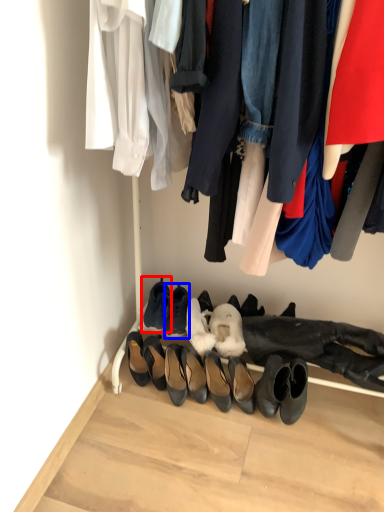
Question: Which object appears farthest to the camera in this image, footwear (highlighted by a red box) or footwear (highlighted by a blue box)?

Choices:
 (A) footwear
 (B) footwear

Answer: (A)